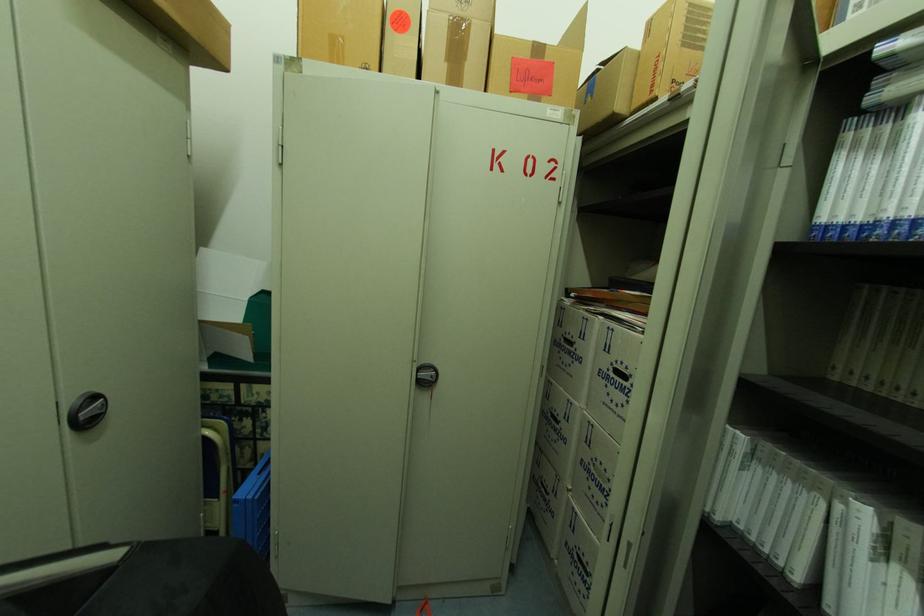
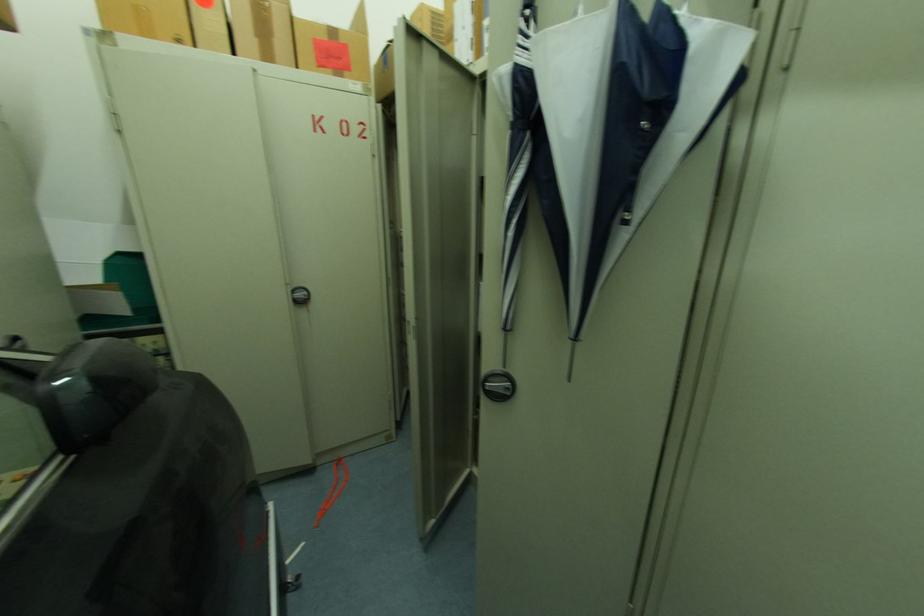
Question: The camera is either moving clockwise (left) or counter-clockwise (right) around the object. The first image is from the beginning of the video and the second image is from the end. Is the camera moving left or right when shooting the video?

Choices:
 (A) Left
 (B) Right

Answer: (A)